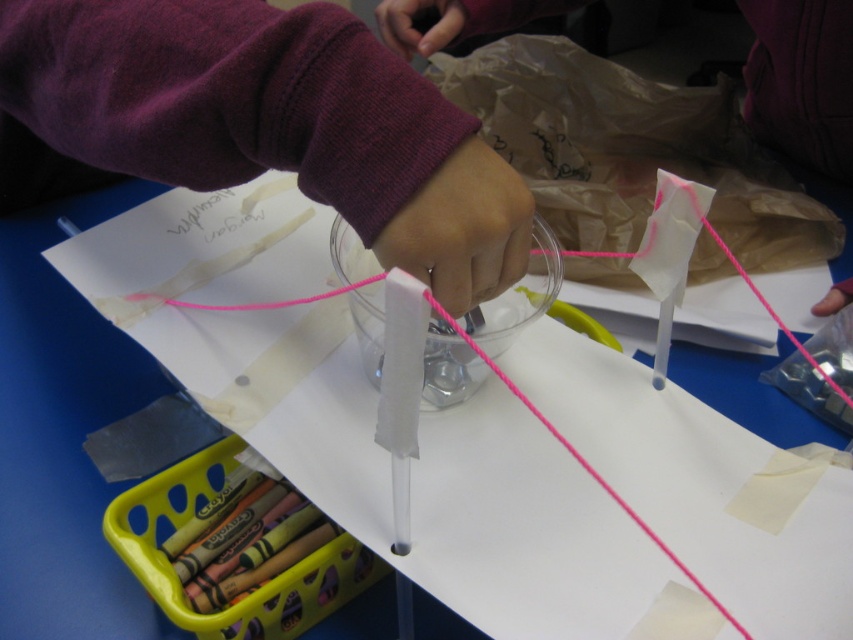
What object is located at the coordinates point (473, 508) in the image?

The point (473, 508) corresponds to the white matte paper at center.

You are a student trying to attach the white matte paper at center and the pink matte string at center to a display board. The board has a maximum spacing requirement of 10 inches between items. Can you place them together without violating the spacing rule?

The white matte paper at center is 10.43 inches from the pink matte string at center. Since the required maximum spacing is 10 inches, placing them together would exceed the allowed distance, so they cannot be placed without violating the spacing rule.